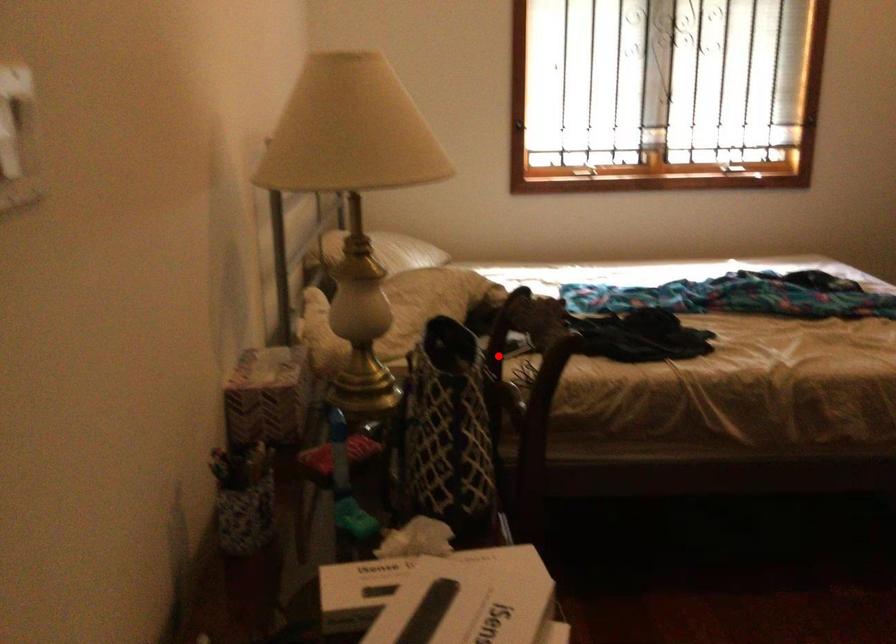
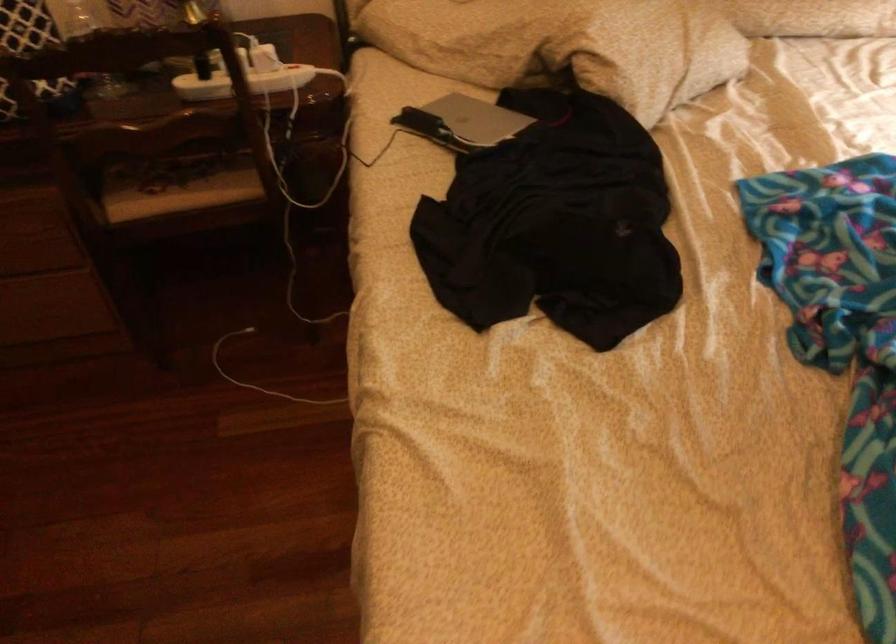
Question: I am providing you with two images of the same scene from different viewpoints. Image1 has a red point marked. In image2, the corresponding 3D location appears at what relative position? Reply with the corresponding letter.

Choices:
 (A) Closer
 (B) Farther

Answer: (A)